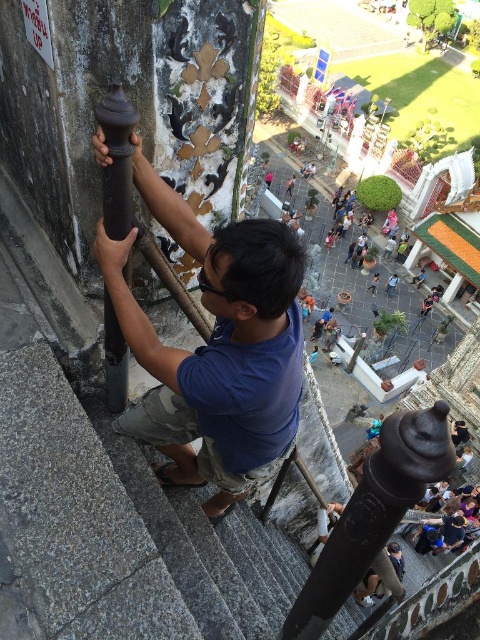
Is point (194, 476) positioned behind point (119, 193)?

Yes, it is.

Which is in front, point (165, 196) or point (123, 128)?

Point (123, 128) is more forward.

Is point (148, 196) positioned after point (127, 371)?

No.

The height and width of the screenshot is (640, 480). I want to click on matte black pole at center, so click(224, 330).

Does matte black pole at center have a lesser width compared to polished dark wood pole at center?

Yes.

Does matte black pole at center appear over polished dark wood pole at center?

Yes, matte black pole at center is above polished dark wood pole at center.

What are the coordinates of `matte black pole at center` in the screenshot? It's located at (224, 330).

Can you confirm if polished dark wood pole at center is thinner than dark brown polished wood at left?

In fact, polished dark wood pole at center might be wider than dark brown polished wood at left.

Is point (351, 496) positioned before point (117, 100)?

That is False.

Locate an element on the screen. polished dark wood pole at center is located at coordinates coord(372,513).